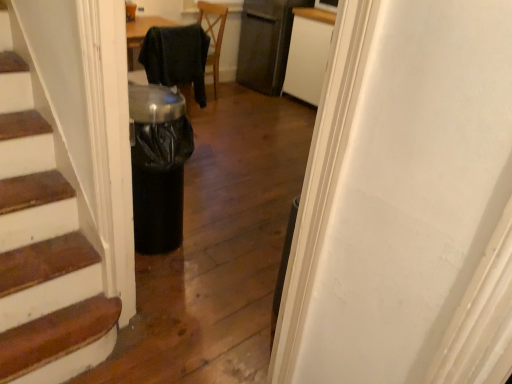
Question: Is white matte cabinet at upper center inside the boundaries of satin black refrigerator at upper center, or outside?

Choices:
 (A) outside
 (B) inside

Answer: (A)

Question: Is point (317, 89) closer or farther from the camera than point (271, 21)?

Choices:
 (A) farther
 (B) closer

Answer: (B)

Question: Estimate the real-world distances between objects in this image. Which object is closer to the white matte cabinet at upper center?

Choices:
 (A) black fabric chair at center
 (B) satin black refrigerator at upper center

Answer: (B)

Question: Which of these objects is positioned closest to the black fabric chair at center?

Choices:
 (A) satin black refrigerator at upper center
 (B) white matte cabinet at upper center

Answer: (B)